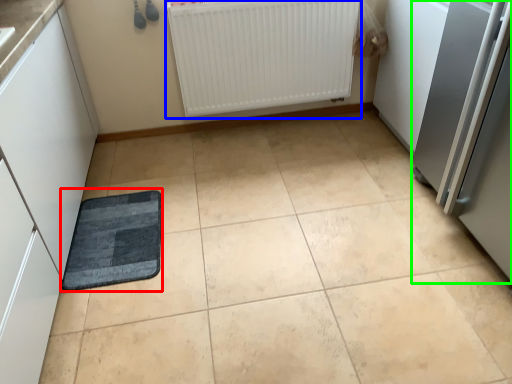
Question: Estimate the real-world distances between objects in this image. Which object is farther from mat (highlighted by a red box), radiator (highlighted by a blue box) or appliance (highlighted by a green box)?

Choices:
 (A) radiator
 (B) appliance

Answer: (B)